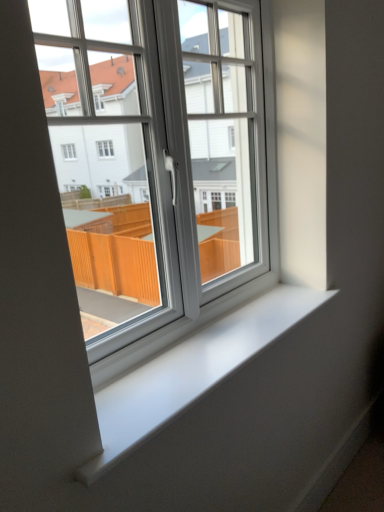
What do you see at coordinates (162, 158) in the screenshot? This screenshot has height=512, width=384. I see `white plastic window at center` at bounding box center [162, 158].

Identify the location of white plastic window at center. (162, 158).

What do you see at coordinates (191, 371) in the screenshot? I see `white smooth window sill at center` at bounding box center [191, 371].

This screenshot has width=384, height=512. Find the location of `white smooth window sill at center`. white smooth window sill at center is located at coordinates (191, 371).

Find the location of `white plastic window at center`. white plastic window at center is located at coordinates (162, 158).

Does white plastic window at center appear on the left side of white smooth window sill at center?

Indeed, white plastic window at center is positioned on the left side of white smooth window sill at center.

Is the depth of white plastic window at center greater than that of white smooth window sill at center?

No, it is not.

Which point is more distant from viewer, (243, 290) or (280, 307)?

The point (243, 290) is more distant.

From the image's perspective, is white plastic window at center located beneath white smooth window sill at center?

Answer: Incorrect, from the image's perspective, white plastic window at center is higher than white smooth window sill at center.

From a real-world perspective, relative to white smooth window sill at center, is white plastic window at center vertically above or below?

white plastic window at center is above white smooth window sill at center.

In the scene shown: Is white plastic window at center thinner than white smooth window sill at center?

Indeed, white plastic window at center has a lesser width compared to white smooth window sill at center.

Considering the sizes of objects white plastic window at center and white smooth window sill at center in the image provided, who is taller, white plastic window at center or white smooth window sill at center?

With more height is white plastic window at center.

Is white plastic window at center smaller than white smooth window sill at center?

Incorrect, white plastic window at center is not smaller in size than white smooth window sill at center.

Does white plastic window at center contain white smooth window sill at center?

That's incorrect, white smooth window sill at center is not inside white plastic window at center.

Are white plastic window at center and white smooth window sill at center far apart?

They are positioned close to each other.

Is white plastic window at center turned away from white smooth window sill at center?

No, white smooth window sill at center is not at the back of white plastic window at center.

How far apart are white plastic window at center and white smooth window sill at center?

A distance of 16.41 inches exists between white plastic window at center and white smooth window sill at center.

Locate an element on the screen. The height and width of the screenshot is (512, 384). window above the white smooth window sill at center (from a real-world perspective) is located at coordinates (162, 158).

Between white smooth window sill at center and white plastic window at center, which one appears on the right side from the viewer's perspective?

Positioned to the right is white smooth window sill at center.

Which object is more forward, white smooth window sill at center or white plastic window at center?

white plastic window at center is more forward.

Considering the points (251, 317) and (106, 242), which point is in front, point (251, 317) or point (106, 242)?

The point (106, 242) is closer.

From the image's perspective, who appears lower, white smooth window sill at center or white plastic window at center?

white smooth window sill at center is shown below in the image.

From a real-world perspective, relative to white plastic window at center, is white smooth window sill at center vertically above or below?

Clearly, from a real-world perspective, white smooth window sill at center is below white plastic window at center.

Considering the relative sizes of white smooth window sill at center and white plastic window at center in the image provided, is white smooth window sill at center wider than white plastic window at center?

Yes, white smooth window sill at center is wider than white plastic window at center.

Which of these two, white smooth window sill at center or white plastic window at center, stands shorter?

Standing shorter between the two is white smooth window sill at center.

Considering the sizes of objects white smooth window sill at center and white plastic window at center in the image provided, who is smaller, white smooth window sill at center or white plastic window at center?

white smooth window sill at center.

Can white plastic window at center be found inside white smooth window sill at center?

No, white plastic window at center is not surrounded by white smooth window sill at center.

Is white smooth window sill at center placed right next to white plastic window at center?

white smooth window sill at center and white plastic window at center are clearly separated.

Does white smooth window sill at center turn towards white plastic window at center?

No, white smooth window sill at center is not facing towards white plastic window at center.

How many degrees apart are the facing directions of white smooth window sill at center and white plastic window at center?

The facing directions of white smooth window sill at center and white plastic window at center are 0.0022 degrees apart.

Measure the distance from white smooth window sill at center to white plastic window at center.

They are 16.41 inches apart.

Identify the location of window located above the white smooth window sill at center (from a real-world perspective). (162, 158).

Find the location of `window above the white smooth window sill at center (from a real-world perspective)`. window above the white smooth window sill at center (from a real-world perspective) is located at coordinates (162, 158).

Where is `window sill below the white plastic window at center (from a real-world perspective)`? The width and height of the screenshot is (384, 512). window sill below the white plastic window at center (from a real-world perspective) is located at coordinates (191, 371).